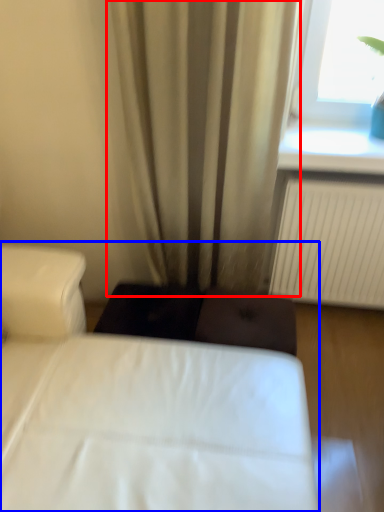
Question: Which object is closer to the camera taking this photo, curtain (highlighted by a red box) or bed (highlighted by a blue box)?

Choices:
 (A) curtain
 (B) bed

Answer: (B)